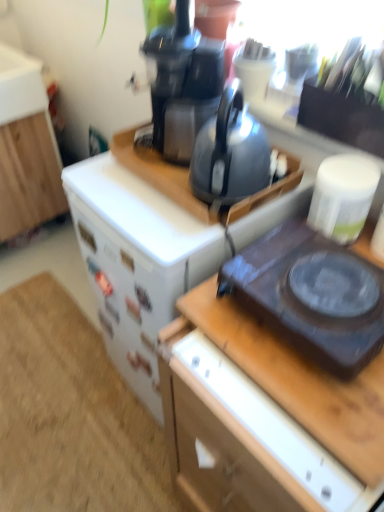
Question: Is the depth of black plastic gas stove at right greater than that of matte black kettle at center?

Choices:
 (A) no
 (B) yes

Answer: (A)

Question: Could you tell me if black plastic gas stove at right is turned towards matte black kettle at center?

Choices:
 (A) yes
 (B) no

Answer: (B)

Question: Considering the relative positions of black plastic gas stove at right and matte black kettle at center in the image provided, is black plastic gas stove at right in front of matte black kettle at center?

Choices:
 (A) no
 (B) yes

Answer: (B)

Question: Is matte black kettle at center surrounded by black plastic gas stove at right?

Choices:
 (A) yes
 (B) no

Answer: (B)

Question: From the image's perspective, would you say black plastic gas stove at right is shown under matte black kettle at center?

Choices:
 (A) no
 (B) yes

Answer: (B)

Question: From the image's perspective, is white wood cabinet at left above or below matte black kettle at center?

Choices:
 (A) below
 (B) above

Answer: (B)

Question: In terms of width, does white wood cabinet at left look wider or thinner when compared to matte black kettle at center?

Choices:
 (A) wide
 (B) thin

Answer: (A)

Question: Considering the positions of white wood cabinet at left and matte black kettle at center in the image, is white wood cabinet at left taller or shorter than matte black kettle at center?

Choices:
 (A) short
 (B) tall

Answer: (B)

Question: Is white wood cabinet at left in front of or behind matte black kettle at center in the image?

Choices:
 (A) front
 (B) behind

Answer: (B)

Question: Is matte black kettle at center in front of or behind black plastic gas stove at right in the image?

Choices:
 (A) front
 (B) behind

Answer: (B)

Question: Considering the positions of point (266, 158) and point (248, 287), is point (266, 158) closer or farther from the camera than point (248, 287)?

Choices:
 (A) closer
 (B) farther

Answer: (B)

Question: Considering the positions of matte black kettle at center and black plastic gas stove at right in the image, is matte black kettle at center wider or thinner than black plastic gas stove at right?

Choices:
 (A) wide
 (B) thin

Answer: (B)

Question: Is matte black kettle at center taller or shorter than black plastic gas stove at right?

Choices:
 (A) short
 (B) tall

Answer: (B)

Question: Is point (14, 120) closer or farther from the camera than point (213, 47)?

Choices:
 (A) farther
 (B) closer

Answer: (A)

Question: Considering the positions of white wood cabinet at left and black plastic coffee pot at upper center in the image, is white wood cabinet at left wider or thinner than black plastic coffee pot at upper center?

Choices:
 (A) thin
 (B) wide

Answer: (B)